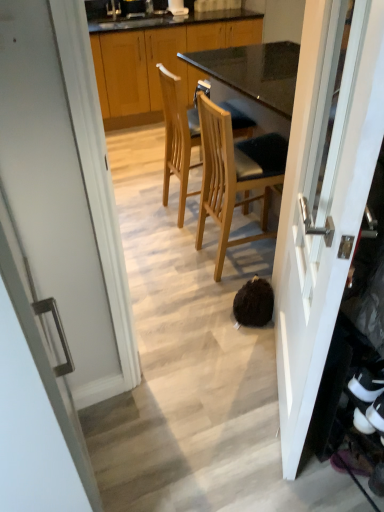
The height and width of the screenshot is (512, 384). What do you see at coordinates (323, 199) in the screenshot? I see `white glossy door at center, which is counted as the 2th door, starting from the left` at bounding box center [323, 199].

What is the approximate height of wooden cabinets at center?

wooden cabinets at center is 1.06 meters in height.

Find the location of `wooden cabinets at center`. wooden cabinets at center is located at coordinates (158, 59).

The image size is (384, 512). Describe the element at coordinates (179, 134) in the screenshot. I see `light brown wood chair at center, arranged as the second chair when viewed from the front` at that location.

This screenshot has height=512, width=384. Identify the location of white glossy door at center, the first door when ordered from left to right. (65, 197).

The image size is (384, 512). Describe the element at coordinates (65, 197) in the screenshot. I see `white glossy door at center, the first door when ordered from left to right` at that location.

Locate an element on the screen. The image size is (384, 512). wooden chair at center, which appears as the 2th chair when viewed from the back is located at coordinates (234, 174).

Identify the location of white glossy door at center, which ranks as the 1th door in right-to-left order. (323, 199).

Could you tell me if light brown wood chair at center, arranged as the second chair when viewed from the front, is turned towards white glossy door at center, which ranks as the 2th door in right-to-left order?

No, light brown wood chair at center, arranged as the second chair when viewed from the front, is not facing towards white glossy door at center, which ranks as the 2th door in right-to-left order.

Which of these two, light brown wood chair at center, which appears as the 1th chair when viewed from the back, or white glossy door at center, which ranks as the 2th door in right-to-left order, is thinner?

white glossy door at center, which ranks as the 2th door in right-to-left order.

What's the angular difference between light brown wood chair at center, arranged as the second chair when viewed from the front, and white glossy door at center, the first door when ordered from left to right,'s facing directions?

2.53 degrees.

Is light brown wood chair at center, arranged as the second chair when viewed from the front, inside the boundaries of white glossy door at center, the first door when ordered from left to right, or outside?

light brown wood chair at center, arranged as the second chair when viewed from the front, is spatially situated outside white glossy door at center, the first door when ordered from left to right.

Does wooden chair at center, marked as the 1th chair in a front-to-back arrangement, touch white glossy door at center, which ranks as the 2th door in right-to-left order?

They are not placed beside each other.

Would you say wooden chair at center, marked as the 1th chair in a front-to-back arrangement, is inside or outside white glossy door at center, the first door when ordered from left to right?

wooden chair at center, marked as the 1th chair in a front-to-back arrangement, is not enclosed by white glossy door at center, the first door when ordered from left to right.

Find the location of a particular element. the 1st door located above the wooden chair at center, marked as the 1th chair in a front-to-back arrangement (from a real-world perspective) is located at coordinates (65, 197).

Which object is wider, wooden chair at center, which appears as the 2th chair when viewed from the back, or white glossy door at center, which ranks as the 2th door in right-to-left order?

With larger width is wooden chair at center, which appears as the 2th chair when viewed from the back.

Is white glossy door at center, the first door when ordered from left to right, next to white glossy door at center, which is counted as the 2th door, starting from the left, and touching it?

There is a gap between white glossy door at center, the first door when ordered from left to right, and white glossy door at center, which is counted as the 2th door, starting from the left.

Does point (81, 62) come in front of point (337, 128)?

That is False.

Is white glossy door at center, the first door when ordered from left to right, at the left side of white glossy door at center, which ranks as the 1th door in right-to-left order?

Yes, white glossy door at center, the first door when ordered from left to right, is to the left of white glossy door at center, which ranks as the 1th door in right-to-left order.

Considering the sizes of white glossy door at center, which is counted as the 2th door, starting from the left, and wooden chair at center, marked as the 1th chair in a front-to-back arrangement, in the image, is white glossy door at center, which is counted as the 2th door, starting from the left, wider or thinner than wooden chair at center, marked as the 1th chair in a front-to-back arrangement,?

In the image, white glossy door at center, which is counted as the 2th door, starting from the left, appears to be more narrow than wooden chair at center, marked as the 1th chair in a front-to-back arrangement.

Which object is further away from the camera taking this photo, white glossy door at center, which is counted as the 2th door, starting from the left, or wooden chair at center, marked as the 1th chair in a front-to-back arrangement?

wooden chair at center, marked as the 1th chair in a front-to-back arrangement, is behind.

Between white glossy door at center, which is counted as the 2th door, starting from the left, and wooden chair at center, marked as the 1th chair in a front-to-back arrangement, which one has larger size?

With larger size is wooden chair at center, marked as the 1th chair in a front-to-back arrangement.

How many degrees apart are the facing directions of white glossy door at center, which ranks as the 1th door in right-to-left order, and wooden chair at center, marked as the 1th chair in a front-to-back arrangement?

The facing directions of white glossy door at center, which ranks as the 1th door in right-to-left order, and wooden chair at center, marked as the 1th chair in a front-to-back arrangement, are 152 degrees apart.

Can we say light brown wood chair at center, arranged as the second chair when viewed from the front, lies outside wooden cabinets at center?

Yes.

Is light brown wood chair at center, arranged as the second chair when viewed from the front, at the right side of wooden cabinets at center?

Indeed, light brown wood chair at center, arranged as the second chair when viewed from the front, is positioned on the right side of wooden cabinets at center.

From the image's perspective, is light brown wood chair at center, arranged as the second chair when viewed from the front, over wooden cabinets at center?

Incorrect, from the image's perspective, light brown wood chair at center, arranged as the second chair when viewed from the front, is lower than wooden cabinets at center.

Is point (186, 112) farther from camera compared to point (190, 25)?

Yes.

Considering the sizes of objects white glossy door at center, which ranks as the 2th door in right-to-left order, and wooden chair at center, marked as the 1th chair in a front-to-back arrangement, in the image provided, who is taller, white glossy door at center, which ranks as the 2th door in right-to-left order, or wooden chair at center, marked as the 1th chair in a front-to-back arrangement,?

white glossy door at center, which ranks as the 2th door in right-to-left order, is taller.

Identify the location of the 2nd door positioned below the wooden chair at center, marked as the 1th chair in a front-to-back arrangement (from the image's perspective). (65, 197).

In terms of width, does white glossy door at center, which ranks as the 2th door in right-to-left order, look wider or thinner when compared to wooden chair at center, marked as the 1th chair in a front-to-back arrangement?

In the image, white glossy door at center, which ranks as the 2th door in right-to-left order, appears to be more narrow than wooden chair at center, marked as the 1th chair in a front-to-back arrangement.

Would you say wooden cabinets at center is outside light brown wood chair at center, which appears as the 1th chair when viewed from the back?

That's correct, wooden cabinets at center is outside of light brown wood chair at center, which appears as the 1th chair when viewed from the back.

The image size is (384, 512). I want to click on cabinetry behind the light brown wood chair at center, which appears as the 1th chair when viewed from the back, so click(158, 59).

Considering the relative positions of wooden cabinets at center and light brown wood chair at center, arranged as the second chair when viewed from the front, in the image provided, is wooden cabinets at center to the right of light brown wood chair at center, arranged as the second chair when viewed from the front, from the viewer's perspective?

Incorrect, wooden cabinets at center is not on the right side of light brown wood chair at center, arranged as the second chair when viewed from the front.

Based on the photo, from the image's perspective, does wooden cabinets at center appear higher than light brown wood chair at center, arranged as the second chair when viewed from the front?

Indeed, from the image's perspective, wooden cabinets at center is shown above light brown wood chair at center, arranged as the second chair when viewed from the front.

Which chair is the 1st one when counting from the right side of the white glossy door at center, which ranks as the 2th door in right-to-left order? Please provide its 2D coordinates.

[(179, 134)]

Locate an element on the screen. The image size is (384, 512). the 1st chair above the white glossy door at center, the first door when ordered from left to right (from the image's perspective) is located at coordinates (234, 174).

From the image, which object appears to be nearer to wooden chair at center, which appears as the 2th chair when viewed from the back, white glossy door at center, the first door when ordered from left to right, or wooden cabinets at center?

Among the two, white glossy door at center, the first door when ordered from left to right, is located nearer to wooden chair at center, which appears as the 2th chair when viewed from the back.

When comparing their distances from wooden chair at center, which appears as the 2th chair when viewed from the back, does light brown wood chair at center, which appears as the 1th chair when viewed from the back, or wooden cabinets at center seem closer?

Based on the image, light brown wood chair at center, which appears as the 1th chair when viewed from the back, appears to be nearer to wooden chair at center, which appears as the 2th chair when viewed from the back.

Based on their spatial positions, is white glossy door at center, which ranks as the 1th door in right-to-left order, or wooden chair at center, which appears as the 2th chair when viewed from the back, closer to light brown wood chair at center, which appears as the 1th chair when viewed from the back?

The object closer to light brown wood chair at center, which appears as the 1th chair when viewed from the back, is wooden chair at center, which appears as the 2th chair when viewed from the back.

In the scene shown: Based on their spatial positions, is light brown wood chair at center, which appears as the 1th chair when viewed from the back, or white glossy door at center, which ranks as the 1th door in right-to-left order, closer to wooden chair at center, marked as the 1th chair in a front-to-back arrangement?

Based on the image, light brown wood chair at center, which appears as the 1th chair when viewed from the back, appears to be nearer to wooden chair at center, marked as the 1th chair in a front-to-back arrangement.

When comparing their distances from white glossy door at center, which is counted as the 2th door, starting from the left, does wooden chair at center, marked as the 1th chair in a front-to-back arrangement, or wooden cabinets at center seem closer?

Based on the image, wooden chair at center, marked as the 1th chair in a front-to-back arrangement, appears to be nearer to white glossy door at center, which is counted as the 2th door, starting from the left.

Considering their positions, is wooden cabinets at center positioned closer to white glossy door at center, which ranks as the 2th door in right-to-left order, than light brown wood chair at center, which appears as the 1th chair when viewed from the back?

Among the two, light brown wood chair at center, which appears as the 1th chair when viewed from the back, is located nearer to white glossy door at center, which ranks as the 2th door in right-to-left order.

When comparing their distances from wooden chair at center, marked as the 1th chair in a front-to-back arrangement, does white glossy door at center, which is counted as the 2th door, starting from the left, or wooden cabinets at center seem closer?

Based on the image, white glossy door at center, which is counted as the 2th door, starting from the left, appears to be nearer to wooden chair at center, marked as the 1th chair in a front-to-back arrangement.

Considering their positions, is white glossy door at center, which ranks as the 2th door in right-to-left order, positioned further to wooden chair at center, which appears as the 2th chair when viewed from the back, than light brown wood chair at center, which appears as the 1th chair when viewed from the back?

white glossy door at center, which ranks as the 2th door in right-to-left order, is further to wooden chair at center, which appears as the 2th chair when viewed from the back.

You are a GUI agent. You are given a task and a screenshot of the screen. Output one action in this format:
    pyautogui.click(x=<x>, y=<y>)
    Task: Click on the chair between white glossy door at center, the first door when ordered from left to right, and light brown wood chair at center, arranged as the second chair when viewed from the front, along the z-axis
    The image size is (384, 512).
    Given the screenshot: What is the action you would take?
    pyautogui.click(x=234, y=174)

Image resolution: width=384 pixels, height=512 pixels. Find the location of `door positioned between white glossy door at center, which ranks as the 2th door in right-to-left order, and wooden chair at center, which appears as the 2th chair when viewed from the back, from near to far`. door positioned between white glossy door at center, which ranks as the 2th door in right-to-left order, and wooden chair at center, which appears as the 2th chair when viewed from the back, from near to far is located at coordinates (323, 199).

Find the location of a particular element. chair located between white glossy door at center, which is counted as the 2th door, starting from the left, and light brown wood chair at center, arranged as the second chair when viewed from the front, in the depth direction is located at coordinates (234, 174).

Where is `door between white glossy door at center, which ranks as the 2th door in right-to-left order, and light brown wood chair at center, which appears as the 1th chair when viewed from the back, from front to back`? door between white glossy door at center, which ranks as the 2th door in right-to-left order, and light brown wood chair at center, which appears as the 1th chair when viewed from the back, from front to back is located at coordinates (323, 199).